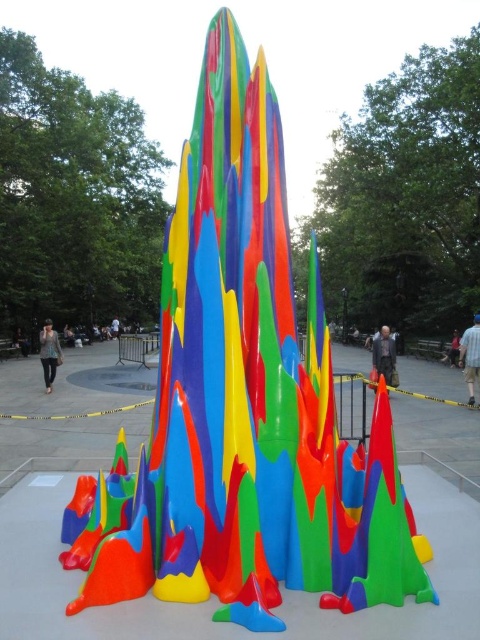
You are a park security guard who notices a denim jacket at lower left and a matte black person at lower left. You need to ensure that the caution tape is not obstructed. Which object is wider so that you know where to adjust the tape?

The denim jacket at lower left might be wider than the matte black person at lower left, so you should adjust the caution tape around the denim jacket at lower left to avoid obstruction.

You are a photographer standing at the camera position. You want to take a photo of the sculpture while ensuring the matte gray jacket at center is not in the frame. Given that the sculpture is on a platform and the jacket is at the center, can you move closer to the sculpture to exclude the jacket from your shot?

The matte gray jacket at center is 12.46 meters away from the camera. Moving closer to the sculpture would reduce the distance, potentially allowing you to frame the shot so the jacket is out of view, but precise adjustments depend on lens focal length and field of view.